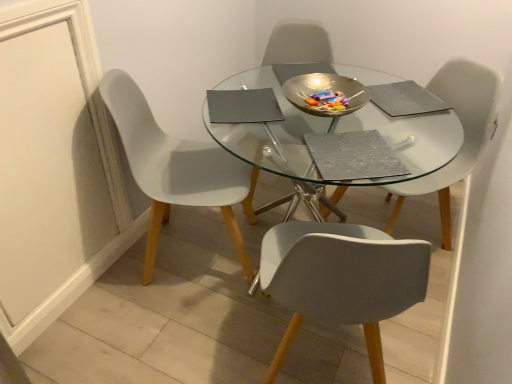
Question: Is white plastic chair at center, which ranks as the third chair in left-to-right order, wider or thinner than white plastic chair at left, positioned as the first chair in left-to-right order?

Choices:
 (A) wide
 (B) thin

Answer: (B)

Question: Would you say white plastic chair at center, which is the first chair in right-to-left order, is to the left or to the right of white plastic chair at left, positioned as the first chair in left-to-right order, in the picture?

Choices:
 (A) left
 (B) right

Answer: (B)

Question: Estimate the real-world distances between objects in this image. Which object is closer to the white plastic chair at center, which ranks as the third chair in left-to-right order?

Choices:
 (A) metallic silver chair at center, which is the second chair from right to left
 (B) white plastic chair at left, placed as the 3th chair when sorted from right to left

Answer: (A)

Question: Which object is the farthest from the white plastic chair at center, which is the first chair in right-to-left order?

Choices:
 (A) white plastic chair at left, placed as the 3th chair when sorted from right to left
 (B) metallic silver chair at center, marked as the 2th chair in a left-to-right arrangement

Answer: (A)